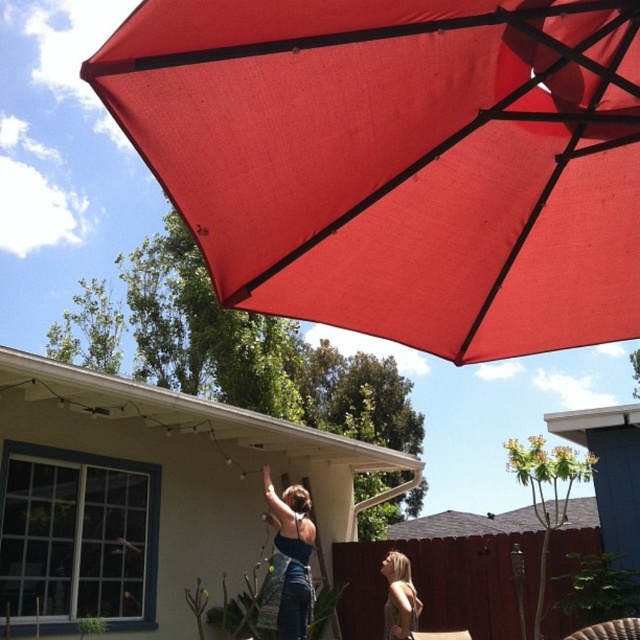
Question: Can you confirm if red matte umbrella at upper center is positioned below golden brown hair at lower right?

Choices:
 (A) yes
 (B) no

Answer: (B)

Question: Estimate the real-world distances between objects in this image. Which object is farther from the golden brown hair at lower right?

Choices:
 (A) red matte umbrella at upper center
 (B) matte blue dress at center

Answer: (A)

Question: Estimate the real-world distances between objects in this image. Which object is farther from the golden brown hair at lower right?

Choices:
 (A) red matte umbrella at upper center
 (B) matte blue dress at center

Answer: (A)

Question: From the image, what is the correct spatial relationship of matte blue dress at center in relation to golden brown hair at lower right?

Choices:
 (A) below
 (B) above

Answer: (B)

Question: Which point is closer to the camera?

Choices:
 (A) (419, 289)
 (B) (388, 564)
 (C) (301, 576)

Answer: (A)

Question: Can you confirm if red matte umbrella at upper center is thinner than golden brown hair at lower right?

Choices:
 (A) yes
 (B) no

Answer: (B)